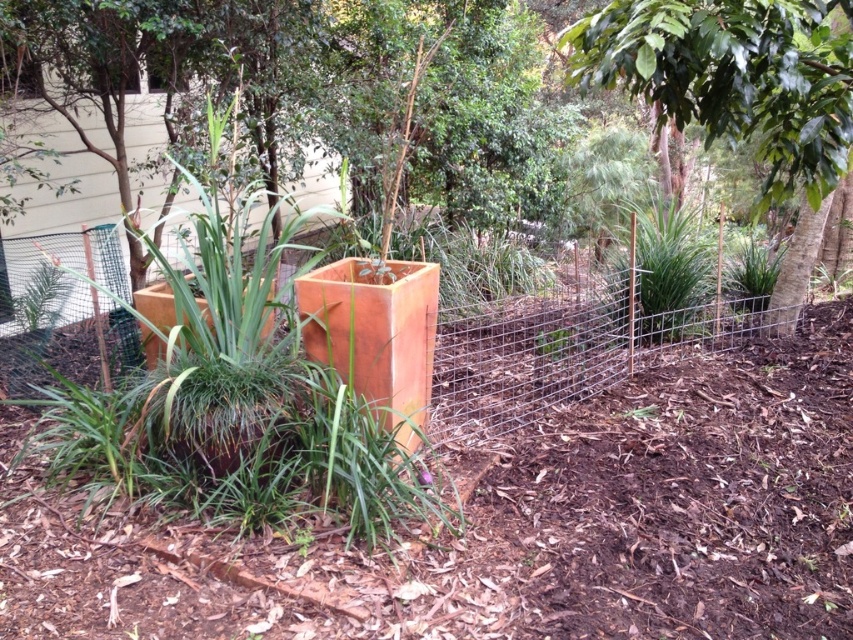
Question: Can you confirm if green leafy tree at center is wider than matte orange planter at center?

Choices:
 (A) no
 (B) yes

Answer: (B)

Question: Among these points, which one is farthest from the camera?

Choices:
 (A) (320, 268)
 (B) (788, 118)

Answer: (A)

Question: Does rusty metal planter at center have a greater width compared to matte orange planter at center?

Choices:
 (A) no
 (B) yes

Answer: (B)

Question: Estimate the real-world distances between objects in this image. Which object is farther from the rusty metal planter at center?

Choices:
 (A) matte orange planter at center
 (B) green grass at center
 (C) green leafy tree at center

Answer: (C)

Question: Is green grass at center positioned behind matte orange planter at center?

Choices:
 (A) no
 (B) yes

Answer: (A)

Question: Among these points, which one is nearest to the camera?

Choices:
 (A) (198, 384)
 (B) (683, 49)
 (C) (149, 294)
 (D) (422, 376)

Answer: (B)